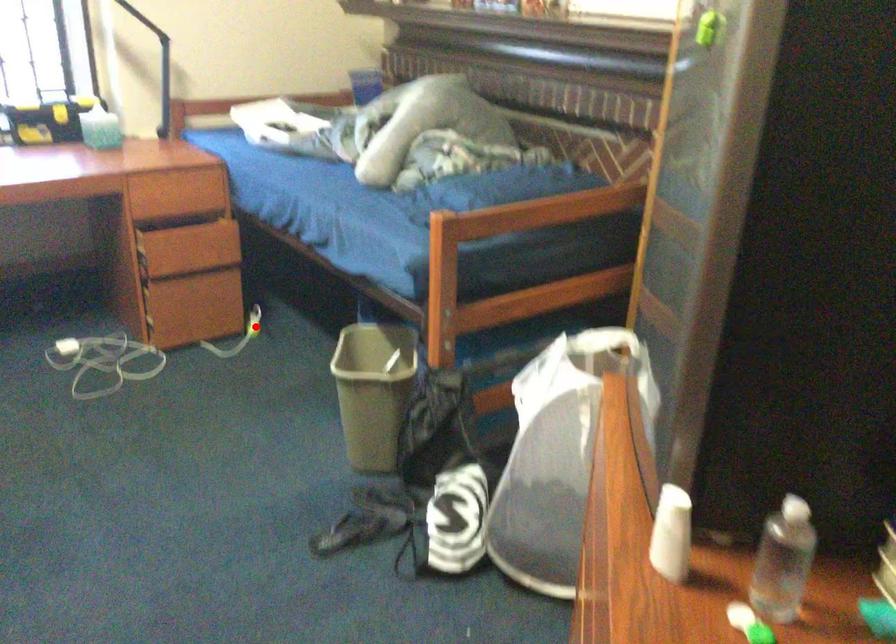
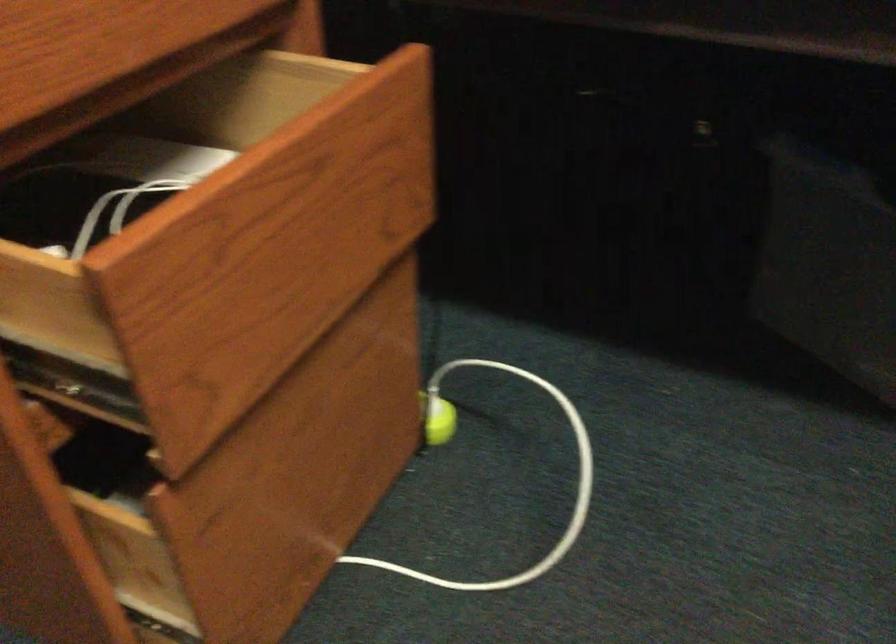
In the second image, find the point that corresponds to the highlighted location in the first image.

(437, 420)